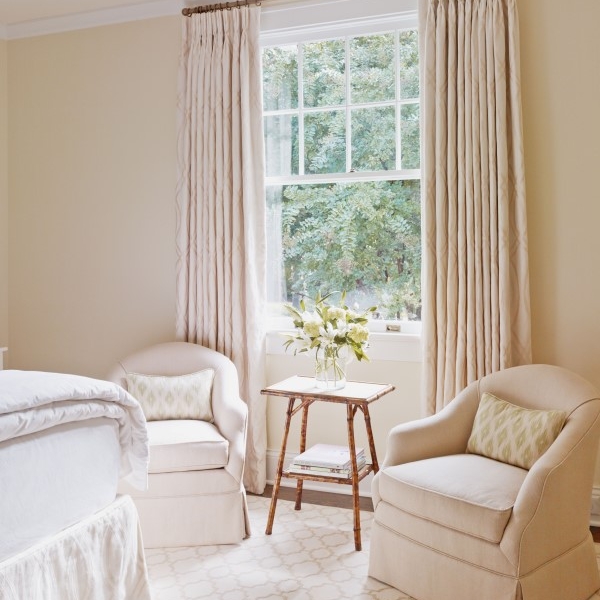
Locate an element on the screen. This screenshot has height=600, width=600. patterned cushions is located at coordinates (167, 395), (516, 430).